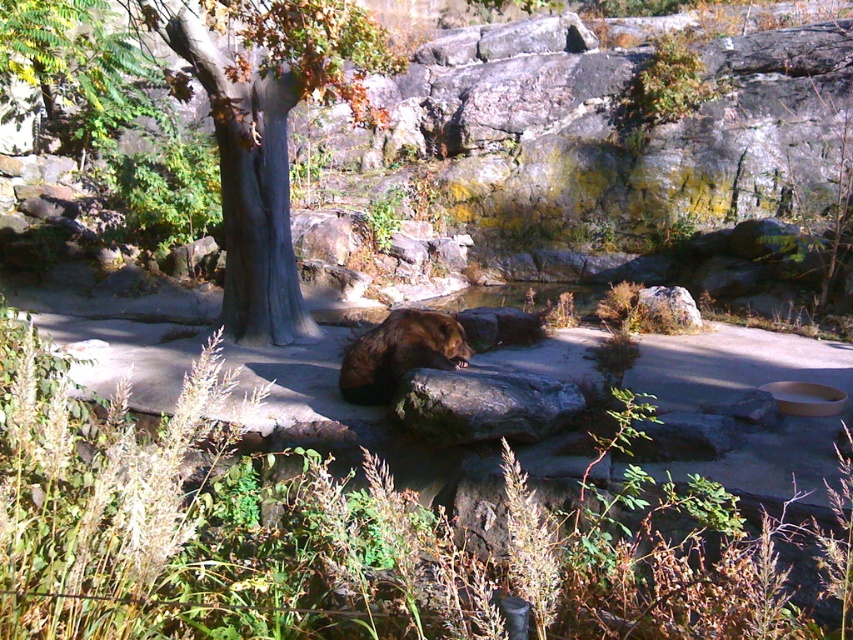
Is gray rough rock at center to the left of brown furry bear at center from the viewer's perspective?

Incorrect, gray rough rock at center is not on the left side of brown furry bear at center.

Measure the distance between point [413,378] and camera.

A distance of 6.27 meters exists between point [413,378] and camera.

Identify the location of gray rough rock at center. This screenshot has height=640, width=853. (483, 404).

Can you confirm if brown wood tree at center is positioned above brown furry bear at center?

Correct, brown wood tree at center is located above brown furry bear at center.

Can you confirm if brown wood tree at center is taller than brown furry bear at center?

Yes.

In order to click on brown wood tree at center in this screenshot , I will do `click(268, 129)`.

Does brown wood tree at center come in front of gray rough rock at center?

No, it is behind gray rough rock at center.

You are a GUI agent. You are given a task and a screenshot of the screen. Output one action in this format:
    pyautogui.click(x=<x>, y=<y>)
    Task: Click on the brown wood tree at center
    The image size is (853, 640).
    Given the screenshot: What is the action you would take?
    pyautogui.click(x=268, y=129)